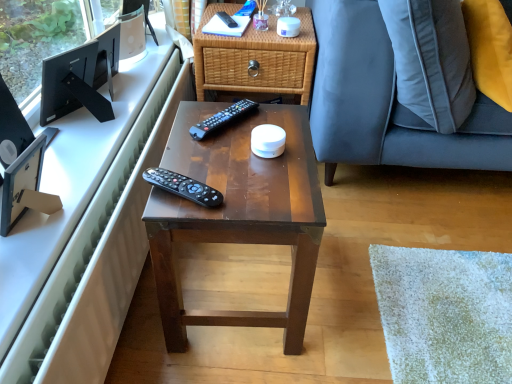
Find the location of a particular element. The width and height of the screenshot is (512, 384). free space that is in between black plastic picture frame at left, which ranks as the first television in front-to-back order, and black matte monitor at upper left, which is the 1th television in top-to-bottom order is located at coordinates (73, 157).